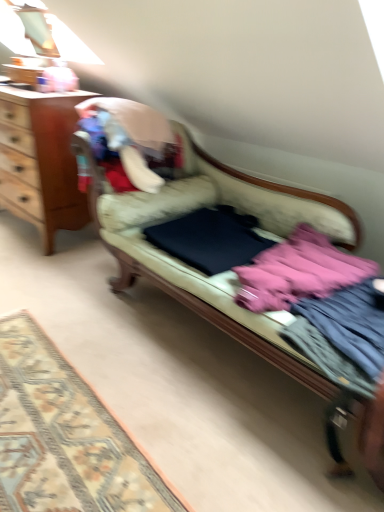
Question: From a real-world perspective, is pink fabric at right, acting as the 2th clothing starting from the back, above or below wooden desk at left?

Choices:
 (A) below
 (B) above

Answer: (A)

Question: Considering their positions, is pink fabric at right, acting as the 2th clothing starting from the back, located in front of or behind wooden desk at left?

Choices:
 (A) front
 (B) behind

Answer: (A)

Question: Estimate the real-world distances between objects in this image. Which object is farther from the carpeted rug at lower left?

Choices:
 (A) pink fabric at right, acting as the 2th clothing starting from the back
 (B) velvet beige couch at center
 (C) pink fabric at center
 (D) wooden desk at left
 (E) dark blue fabric at center, the first clothing viewed from the back

Answer: (D)

Question: Which object is positioned farthest from the dark blue fabric at center, the first clothing viewed from the back?

Choices:
 (A) carpeted rug at lower left
 (B) pink fabric at center
 (C) velvet beige couch at center
 (D) pink fabric at right, acting as the 2th clothing starting from the back
 (E) wooden desk at left

Answer: (E)